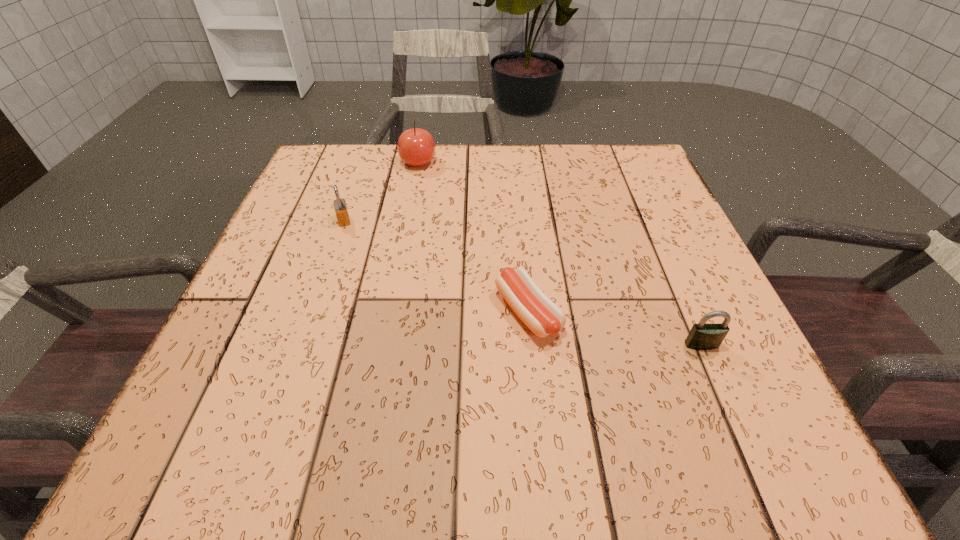
Where is `free spot between the nearer padlock and the third object from right to left`? This screenshot has width=960, height=540. free spot between the nearer padlock and the third object from right to left is located at coordinates pos(560,254).

Image resolution: width=960 pixels, height=540 pixels. I want to click on free space between the shortest object and the second object from left to right, so click(473, 237).

At what (x,y) coordinates should I click in order to perform the action: click on vacant space that's between the apple and the right padlock. Please return your answer as a coordinate pair (x, y). Looking at the image, I should click on (560, 254).

At what (x,y) coordinates should I click in order to perform the action: click on free space between the sausage and the right padlock. Please return your answer as a coordinate pair (x, y). The width and height of the screenshot is (960, 540). Looking at the image, I should click on (614, 328).

Find the location of `vacant area that lies between the farther padlock and the second object from right to left`. vacant area that lies between the farther padlock and the second object from right to left is located at coordinates (436, 266).

The image size is (960, 540). In order to click on free space between the rightmost object and the second object from right to left in this screenshot , I will do 614,328.

I want to click on unoccupied area between the nearer padlock and the tallest object, so click(560, 254).

Identify the location of object that ranks as the third closest to the left padlock. The width and height of the screenshot is (960, 540). (703, 336).

You are a GUI agent. You are given a task and a screenshot of the screen. Output one action in this format:
    pyautogui.click(x=<x>, y=<y>)
    Task: Click on the object that is the closest to the farther padlock
    The width and height of the screenshot is (960, 540).
    Given the screenshot: What is the action you would take?
    pyautogui.click(x=416, y=147)

Where is `vacant region that satisfies the following two spatial constraints: 1. on the front side of the nearer padlock; 2. on the right side of the second farthest object`? vacant region that satisfies the following two spatial constraints: 1. on the front side of the nearer padlock; 2. on the right side of the second farthest object is located at coordinates (300, 345).